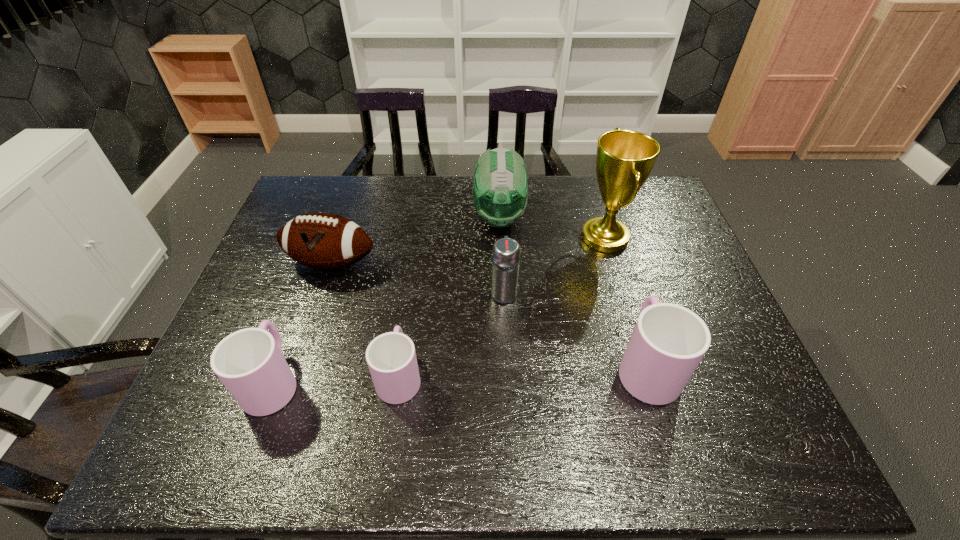
At what (x,y) coordinates should I click in order to perform the action: click on vacant area situated by the handles of the award. Please return your answer as a coordinate pair (x, y). Looking at the image, I should click on (494, 238).

Find the location of `blank area located with a handle on the side of the thermos bottle`. blank area located with a handle on the side of the thermos bottle is located at coordinates (500, 226).

At what (x,y) coordinates should I click in order to perform the action: click on vacant position located with a handle on the side of the thermos bottle. Please return your answer as a coordinate pair (x, y). This screenshot has width=960, height=540. Looking at the image, I should click on (499, 207).

At what (x,y) coordinates should I click in order to perform the action: click on vacant point located 0.370m with a handle on the side of the thermos bottle. Please return your answer as a coordinate pair (x, y). Looking at the image, I should click on (499, 201).

Identify the location of vacant space located on the right of the football (American). (502, 263).

You are a GUI agent. You are given a task and a screenshot of the screen. Output one action in this format:
    pyautogui.click(x=<x>, y=<y>)
    Task: Click on the football helmet that is at the far edge
    The width and height of the screenshot is (960, 540).
    Given the screenshot: What is the action you would take?
    pyautogui.click(x=500, y=193)

Find the location of a particular element. The width and height of the screenshot is (960, 540). award that is at the far edge is located at coordinates (625, 158).

Locate an element on the screen. This screenshot has height=540, width=960. cup that is at the left edge is located at coordinates (249, 362).

Find the location of a particular element. football (American) located in the left edge section of the desktop is located at coordinates (323, 241).

Locate an element on the screen. The width and height of the screenshot is (960, 540). object at the near left corner is located at coordinates point(249,362).